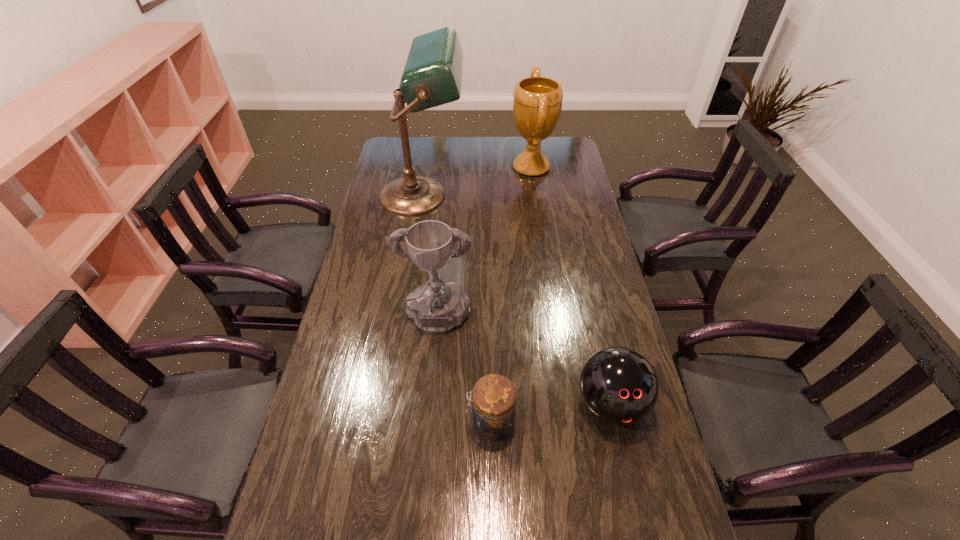
The height and width of the screenshot is (540, 960). In order to click on object that is the fourth closest one to the table lamp in this screenshot , I will do `click(493, 411)`.

Locate an element on the screen. object that is the third nearest to the right award is located at coordinates (620, 386).

The width and height of the screenshot is (960, 540). In order to click on vacant point that satisfies the following two spatial constraints: 1. on the surface of the bowling ball near the finger holes; 2. on the lid of the shortest object in this screenshot , I will do `click(614, 422)`.

Find the location of `free space that satisfies the following two spatial constraints: 1. on the surface of the bowling ball near the finger holes; 2. on the lid of the shortest object`. free space that satisfies the following two spatial constraints: 1. on the surface of the bowling ball near the finger holes; 2. on the lid of the shortest object is located at coordinates (614, 422).